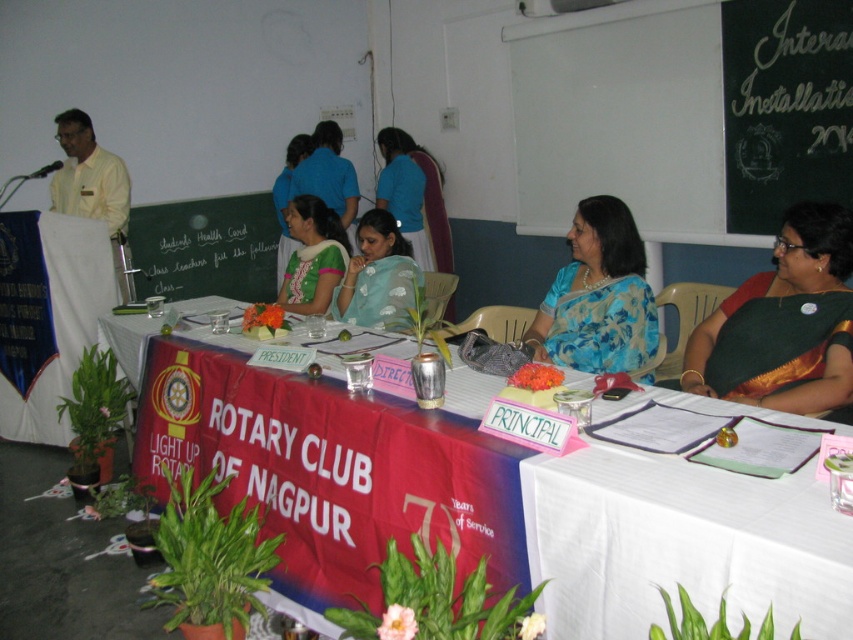
Question: Which object is the closest to the green embroidered blouse at center?

Choices:
 (A) blue silk saree at center
 (B) light blue saree at center
 (C) green chalkboard at upper center
 (D) green silk saree at right

Answer: (B)

Question: Is green chalkboard at upper center positioned before light blue saree at center?

Choices:
 (A) yes
 (B) no

Answer: (A)

Question: Where is black chalkboard at center located in relation to light blue saree at center in the image?

Choices:
 (A) above
 (B) below

Answer: (A)

Question: Considering the relative positions of green silk saree at right and green embroidered blouse at center in the image provided, where is green silk saree at right located with respect to green embroidered blouse at center?

Choices:
 (A) right
 (B) left

Answer: (A)

Question: Which point is closer to the camera?

Choices:
 (A) (619, 486)
 (B) (229, 243)
 (C) (590, 260)

Answer: (A)

Question: Which point is closer to the camera?

Choices:
 (A) (338, 246)
 (B) (360, 230)
 (C) (621, 358)
 (D) (746, 307)

Answer: (D)